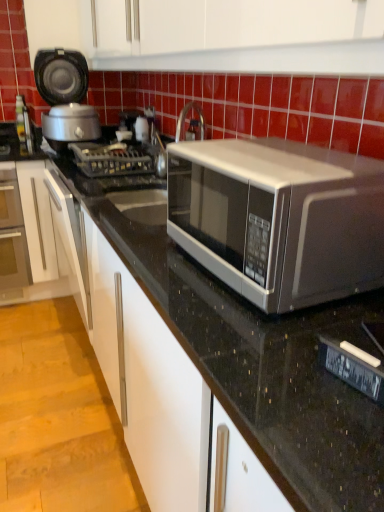
The width and height of the screenshot is (384, 512). Identify the location of free space above satin silver microwave at center (from a real-world perspective). (274, 150).